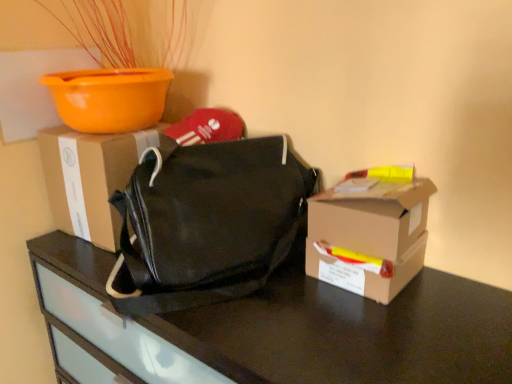
This screenshot has width=512, height=384. Find the location of `vacant space to the left of brown cardboard box at right, the first box in the front-to-back sequence`. vacant space to the left of brown cardboard box at right, the first box in the front-to-back sequence is located at coordinates (283, 307).